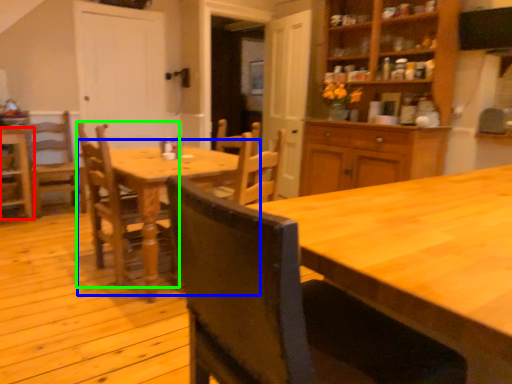
Question: Which is nearer to the chair (highlighted by a red box)? kitchen & dining room table (highlighted by a blue box) or chair (highlighted by a green box).

Choices:
 (A) kitchen & dining room table
 (B) chair

Answer: (B)